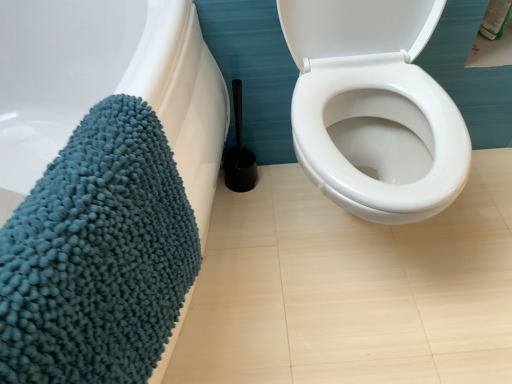
Question: Is teal chenille bath towel at left thinner than black plastic toilet brush at center?

Choices:
 (A) yes
 (B) no

Answer: (B)

Question: From the image's perspective, is teal chenille bath towel at left located beneath black plastic toilet brush at center?

Choices:
 (A) yes
 (B) no

Answer: (A)

Question: Considering the relative positions of teal chenille bath towel at left and black plastic toilet brush at center in the image provided, is teal chenille bath towel at left behind black plastic toilet brush at center?

Choices:
 (A) yes
 (B) no

Answer: (B)

Question: Considering the relative sizes of teal chenille bath towel at left and black plastic toilet brush at center in the image provided, is teal chenille bath towel at left smaller than black plastic toilet brush at center?

Choices:
 (A) yes
 (B) no

Answer: (B)

Question: Is teal chenille bath towel at left outside black plastic toilet brush at center?

Choices:
 (A) yes
 (B) no

Answer: (A)

Question: Is teal chenille bath towel at left bigger than black plastic toilet brush at center?

Choices:
 (A) yes
 (B) no

Answer: (A)

Question: From the image's perspective, is black plastic toilet brush at center under teal chenille bath towel at left?

Choices:
 (A) no
 (B) yes

Answer: (A)

Question: Is black plastic toilet brush at center completely or partially outside of teal chenille bath towel at left?

Choices:
 (A) no
 (B) yes

Answer: (B)

Question: From the image's perspective, does black plastic toilet brush at center appear higher than teal chenille bath towel at left?

Choices:
 (A) yes
 (B) no

Answer: (A)

Question: Is black plastic toilet brush at center directly adjacent to teal chenille bath towel at left?

Choices:
 (A) no
 (B) yes

Answer: (A)

Question: Can you confirm if black plastic toilet brush at center is thinner than teal chenille bath towel at left?

Choices:
 (A) no
 (B) yes

Answer: (B)

Question: Is black plastic toilet brush at center to the left of teal chenille bath towel at left from the viewer's perspective?

Choices:
 (A) no
 (B) yes

Answer: (A)

Question: In terms of height, does teal chenille bath towel at left look taller or shorter compared to black plastic toilet brush at center?

Choices:
 (A) short
 (B) tall

Answer: (B)